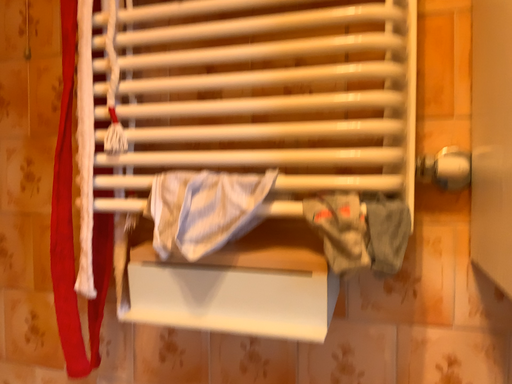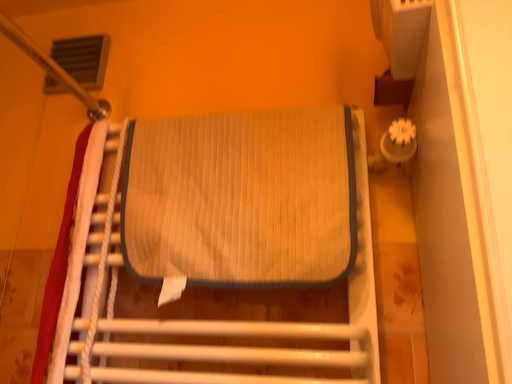
Question: Which way did the camera rotate in the video?

Choices:
 (A) rotated upward
 (B) rotated downward

Answer: (A)